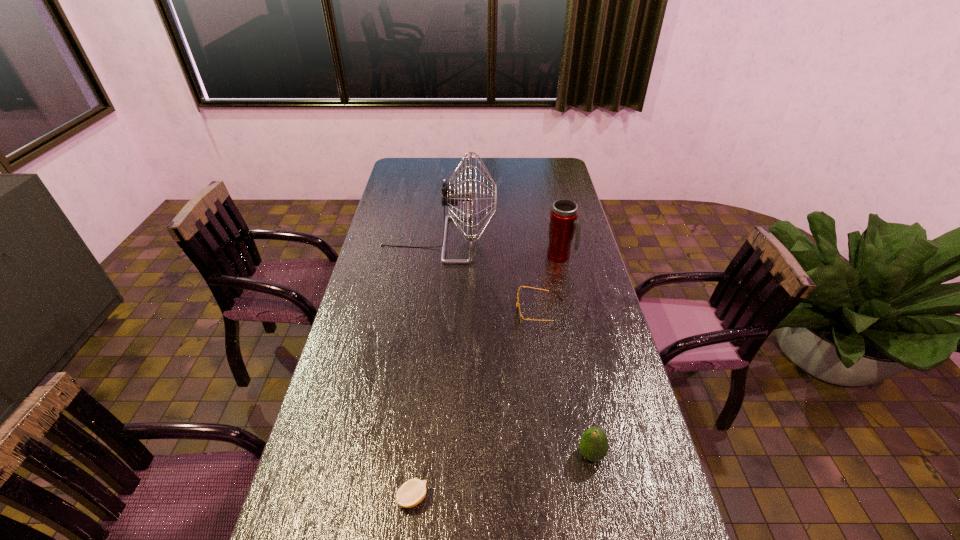
Find the location of a particular element. The image size is (960, 540). the tallest object is located at coordinates (451, 197).

Identify the location of thermos bottle. This screenshot has height=540, width=960. (563, 219).

Locate an element on the screen. The height and width of the screenshot is (540, 960). the fourth farthest object is located at coordinates (594, 445).

Where is `the third tallest object`? This screenshot has width=960, height=540. the third tallest object is located at coordinates (594, 445).

This screenshot has height=540, width=960. I want to click on the second shortest object, so click(x=519, y=314).

The height and width of the screenshot is (540, 960). What are the coordinates of `sunglasses` in the screenshot? It's located at click(519, 314).

This screenshot has height=540, width=960. I want to click on lemon, so click(x=412, y=492).

I want to click on the shortest object, so click(x=412, y=492).

Where is `vacant area situated on the front-facing side of the fan`? The width and height of the screenshot is (960, 540). vacant area situated on the front-facing side of the fan is located at coordinates (583, 240).

Identify the location of blank space located on the left of the third shortest object. The image size is (960, 540). (494, 454).